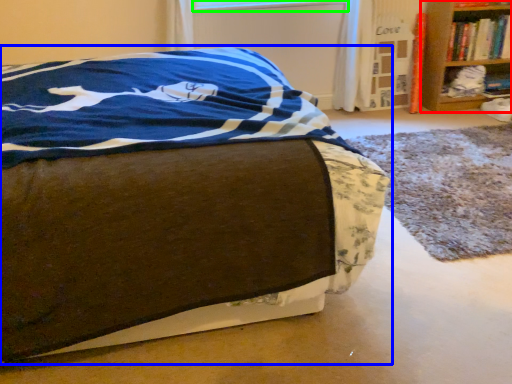
Question: Which object is the closest to the shelf (highlighted by a red box)? Choose among these: bed (highlighted by a blue box) or window screen (highlighted by a green box).

Choices:
 (A) bed
 (B) window screen

Answer: (B)